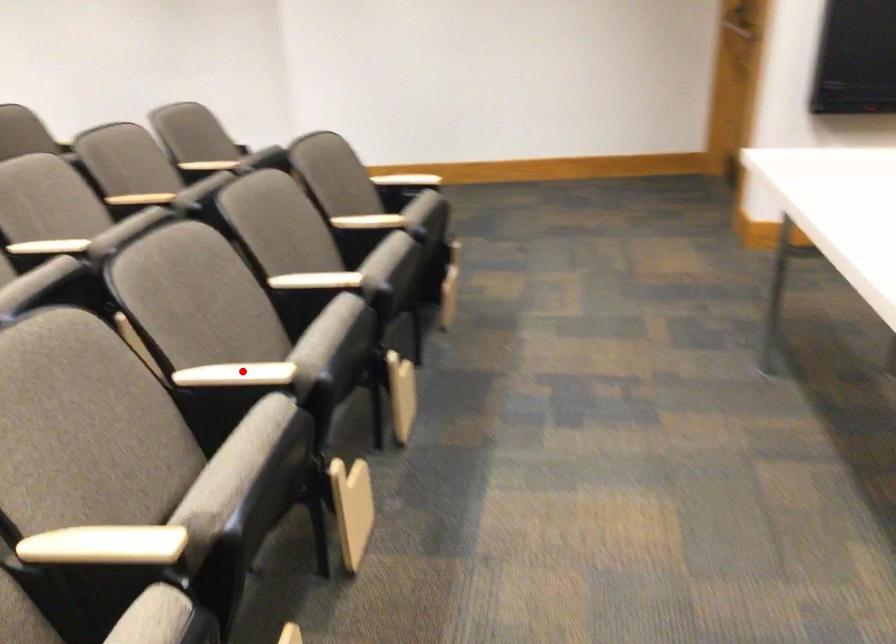
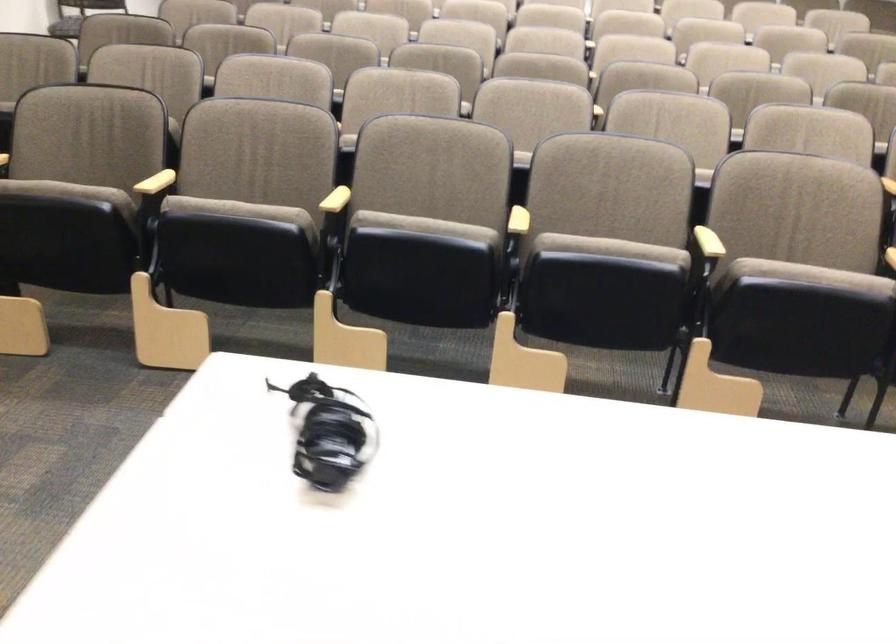
Find the pixel in the second image that matches the highlighted location in the first image.

(518, 221)